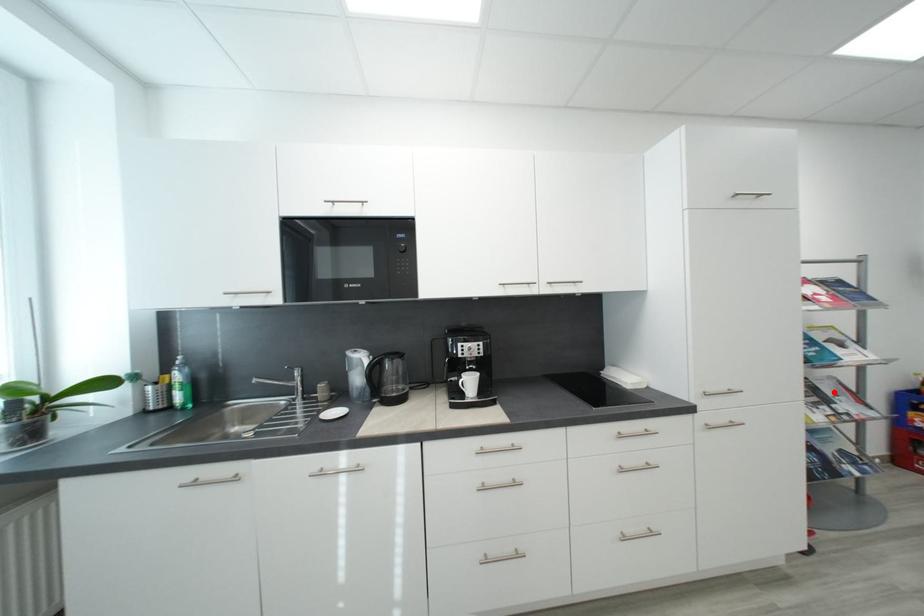
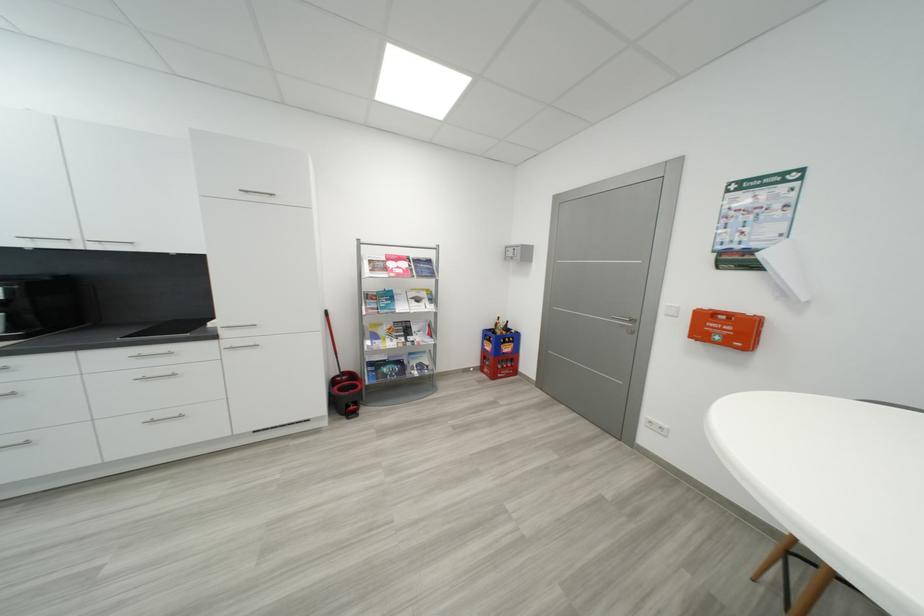
Locate, in the second image, the point that corresponds to the highlighted location in the first image.

(421, 330)